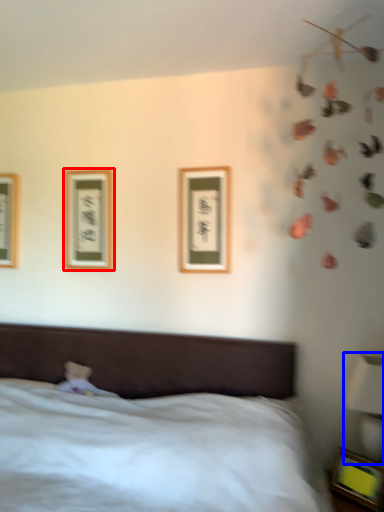
Question: Among these objects, which one is farthest to the camera, picture frame (highlighted by a red box) or bedside lamp (highlighted by a blue box)?

Choices:
 (A) picture frame
 (B) bedside lamp

Answer: (A)